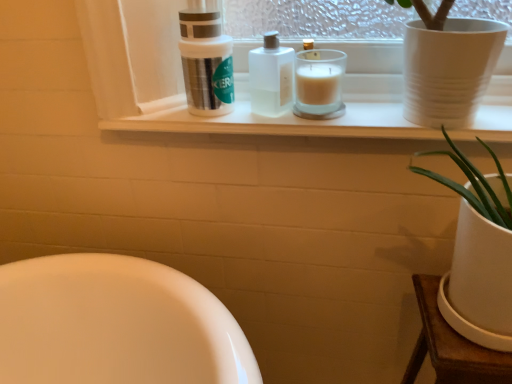
At what (x,y) coordinates should I click in order to perform the action: click on clear plastic bottle at center. Please return your answer as a coordinate pair (x, y). The height and width of the screenshot is (384, 512). Looking at the image, I should click on (271, 77).

What are the coordinates of `silver metallic container at upper center` in the screenshot? It's located at (206, 62).

Where is `translucent glass candle at center`? translucent glass candle at center is located at coordinates (319, 84).

Identify the location of clear plastic bottle at center. The width and height of the screenshot is (512, 384). (271, 77).

Is the surface of clear plastic bottle at center in direct contact with translucent glass candle at center?

Yes, clear plastic bottle at center is with translucent glass candle at center.

How many degrees apart are the facing directions of clear plastic bottle at center and translucent glass candle at center?

0.000123 degrees separate the facing orientations of clear plastic bottle at center and translucent glass candle at center.

From a real-world perspective, is clear plastic bottle at center positioned over translucent glass candle at center based on gravity?

Yes.

How much distance is there between clear plastic bottle at center and translucent glass candle at center?

A distance of 2.33 inches exists between clear plastic bottle at center and translucent glass candle at center.

How distant is silver metallic container at upper center from translucent glass candle at center?

silver metallic container at upper center is 18.61 centimeters from translucent glass candle at center.

Does silver metallic container at upper center appear on the right side of translucent glass candle at center?

A: In fact, silver metallic container at upper center is to the left of translucent glass candle at center.

Locate an element on the screen. The width and height of the screenshot is (512, 384). candle holder lying on the right of silver metallic container at upper center is located at coordinates (319, 84).

Considering the positions of point (230, 66) and point (310, 88), is point (230, 66) closer or farther from the camera than point (310, 88)?

Point (230, 66).

Considering the relative sizes of white matte window sill at upper center and translucent glass candle at center in the image provided, is white matte window sill at upper center taller than translucent glass candle at center?

Incorrect, the height of white matte window sill at upper center is not larger of that of translucent glass candle at center.

Can you tell me how much white matte window sill at upper center and translucent glass candle at center differ in facing direction?

The angular difference between white matte window sill at upper center and translucent glass candle at center is 1.5 degrees.

The width and height of the screenshot is (512, 384). Identify the location of candle holder above the white matte window sill at upper center (from a real-world perspective). (319, 84).

From the image's perspective, which one is positioned higher, white matte window sill at upper center or silver metallic container at upper center?

silver metallic container at upper center is shown above in the image.

How much distance is there between white matte window sill at upper center and silver metallic container at upper center?

white matte window sill at upper center and silver metallic container at upper center are 15.99 centimeters apart from each other.

Is white matte window sill at upper center not near silver metallic container at upper center?

No, white matte window sill at upper center is not far away from silver metallic container at upper center.

In the scene shown: Considering the relative sizes of white matte window sill at upper center and silver metallic container at upper center in the image provided, is white matte window sill at upper center thinner than silver metallic container at upper center?

No, white matte window sill at upper center is not thinner than silver metallic container at upper center.

Considering the positions of objects silver metallic container at upper center and white matte window sill at upper center in the image provided, who is more to the right, silver metallic container at upper center or white matte window sill at upper center?

white matte window sill at upper center.

Based on the photo, from a real-world perspective, is silver metallic container at upper center physically below white matte window sill at upper center?

No, from a real-world perspective, silver metallic container at upper center is not below white matte window sill at upper center.

The height and width of the screenshot is (384, 512). Identify the location of cleaning product above the white matte window sill at upper center (from a real-world perspective). (206, 62).

Measure the distance between silver metallic container at upper center and white matte window sill at upper center.

silver metallic container at upper center is 6.29 inches away from white matte window sill at upper center.

Is white matte window sill at upper center wider than clear plastic bottle at center?

Correct, the width of white matte window sill at upper center exceeds that of clear plastic bottle at center.

Is white matte window sill at upper center turned away from clear plastic bottle at center?

No, clear plastic bottle at center is not at the back of white matte window sill at upper center.

Is white matte window sill at upper center with clear plastic bottle at center?

white matte window sill at upper center is not next to clear plastic bottle at center, and they're not touching.

In the scene shown: Between white matte window sill at upper center and clear plastic bottle at center, which one has smaller size?

Smaller between the two is clear plastic bottle at center.

How far apart are silver metallic container at upper center and clear plastic bottle at center?

silver metallic container at upper center is 3.85 inches away from clear plastic bottle at center.

Considering the points (207, 78) and (273, 60), which point is in front, point (207, 78) or point (273, 60)?

Point (273, 60)

Could you tell me if silver metallic container at upper center is facing clear plastic bottle at center?

No, silver metallic container at upper center is not oriented towards clear plastic bottle at center.

Where is `toiletry that is under the silver metallic container at upper center (from a real-world perspective)`? toiletry that is under the silver metallic container at upper center (from a real-world perspective) is located at coordinates (271, 77).

The width and height of the screenshot is (512, 384). What are the coordinates of `candle holder that is below the clear plastic bottle at center (from the image's perspective)` in the screenshot? It's located at (319, 84).

What are the coordinates of `cleaning product that is above the translucent glass candle at center (from a real-world perspective)` in the screenshot? It's located at (206, 62).

Considering their positions, is translucent glass candle at center positioned further to silver metallic container at upper center than white matte window sill at upper center?

The object further to silver metallic container at upper center is translucent glass candle at center.

Considering their positions, is silver metallic container at upper center positioned closer to white matte window sill at upper center than clear plastic bottle at center?

Based on the image, clear plastic bottle at center appears to be nearer to white matte window sill at upper center.

From the image, which object appears to be nearer to white matte window sill at upper center, translucent glass candle at center or clear plastic bottle at center?

translucent glass candle at center is closer to white matte window sill at upper center.

Considering their positions, is white matte window sill at upper center positioned further to clear plastic bottle at center than translucent glass candle at center?

white matte window sill at upper center.

Looking at the image, which one is located further to silver metallic container at upper center, translucent glass candle at center or clear plastic bottle at center?

translucent glass candle at center.

Estimate the real-world distances between objects in this image. Which object is closer to clear plastic bottle at center, silver metallic container at upper center or translucent glass candle at center?

translucent glass candle at center is closer to clear plastic bottle at center.

Looking at the image, which one is located further to white matte window sill at upper center, silver metallic container at upper center or translucent glass candle at center?

Based on the image, silver metallic container at upper center appears to be further to white matte window sill at upper center.

Looking at the image, which one is located further to translucent glass candle at center, clear plastic bottle at center or white matte window sill at upper center?

white matte window sill at upper center is further to translucent glass candle at center.

This screenshot has height=384, width=512. Identify the location of toiletry located between silver metallic container at upper center and translucent glass candle at center in the left-right direction. (271, 77).

Identify the location of toiletry between silver metallic container at upper center and white matte window sill at upper center from left to right. (271, 77).

Identify the location of window sill situated between silver metallic container at upper center and translucent glass candle at center from left to right. This screenshot has height=384, width=512. (266, 117).

Image resolution: width=512 pixels, height=384 pixels. Identify the location of window sill between clear plastic bottle at center and translucent glass candle at center. (266, 117).